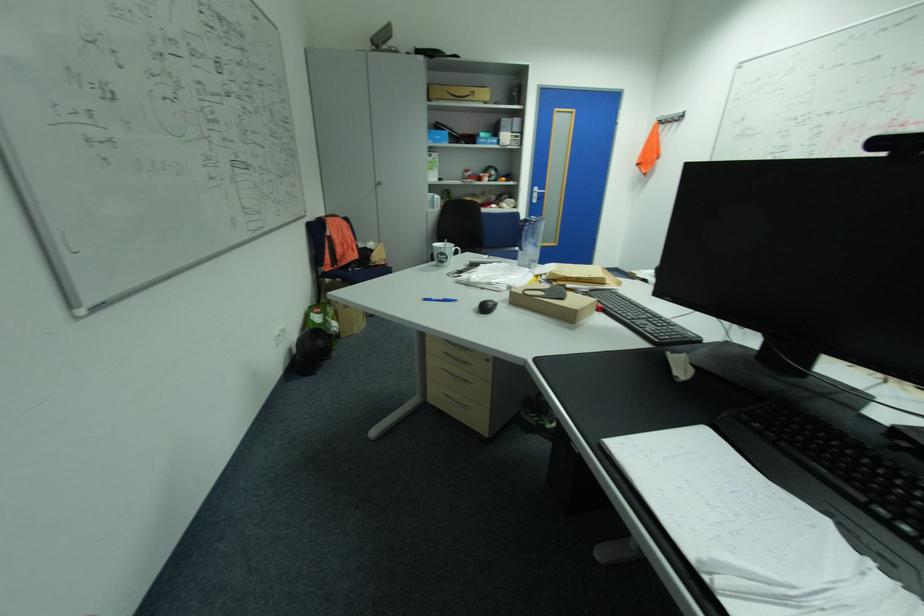
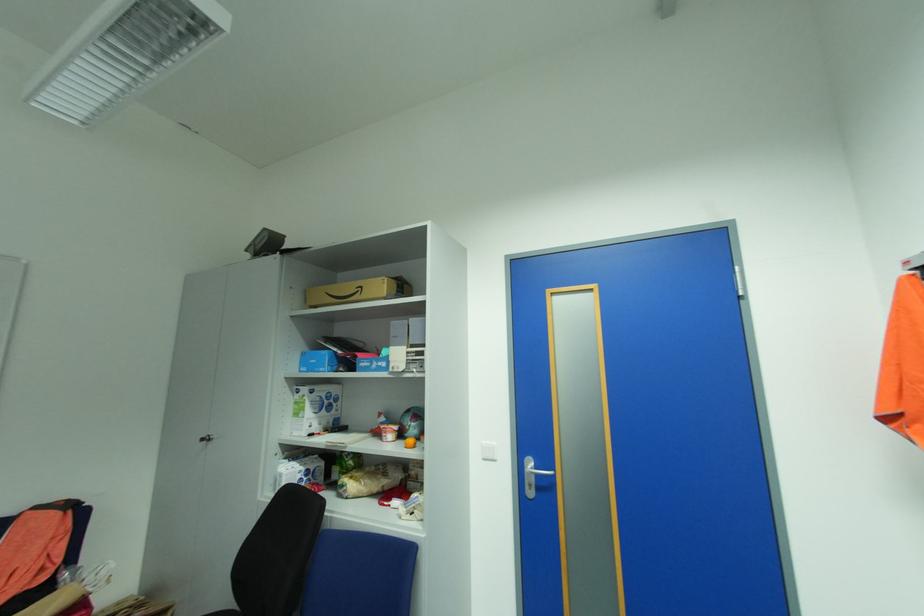
In the second image, find the point that corresponds to the point at 386,184 in the first image.

(213, 439)